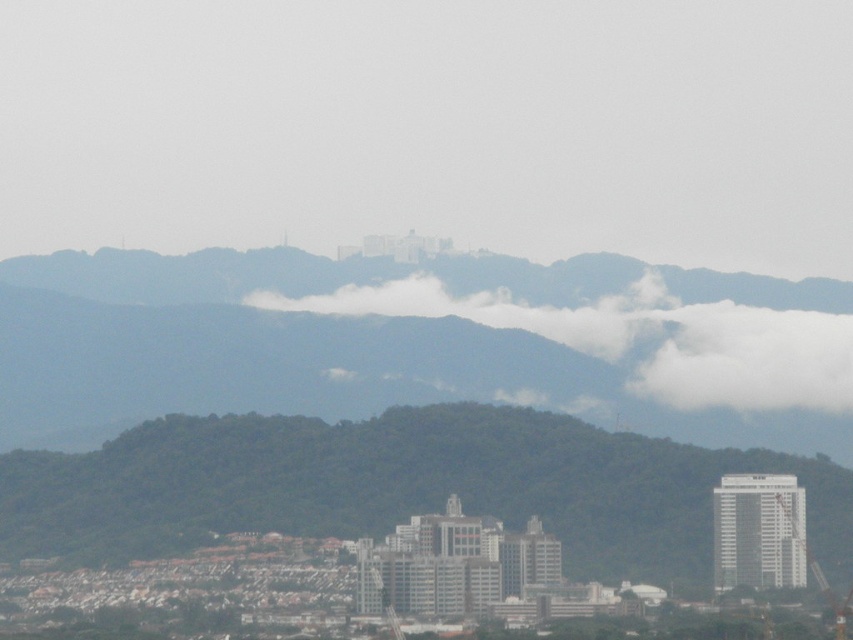
Question: Is green leafy hill at center in front of white fluffy cloud at center?

Choices:
 (A) no
 (B) yes

Answer: (A)

Question: Can you confirm if green leafy hill at center is positioned above white fluffy cloud at center?

Choices:
 (A) no
 (B) yes

Answer: (A)

Question: Which of the following is the farthest from the observer?

Choices:
 (A) white fluffy cloud at center
 (B) green leafy hill at center

Answer: (B)

Question: Observing the image, what is the correct spatial positioning of green leafy hill at center in reference to white fluffy cloud at center?

Choices:
 (A) above
 (B) below

Answer: (B)

Question: Which point is farther to the camera?

Choices:
 (A) green leafy hill at center
 (B) white fluffy cloud at center

Answer: (A)